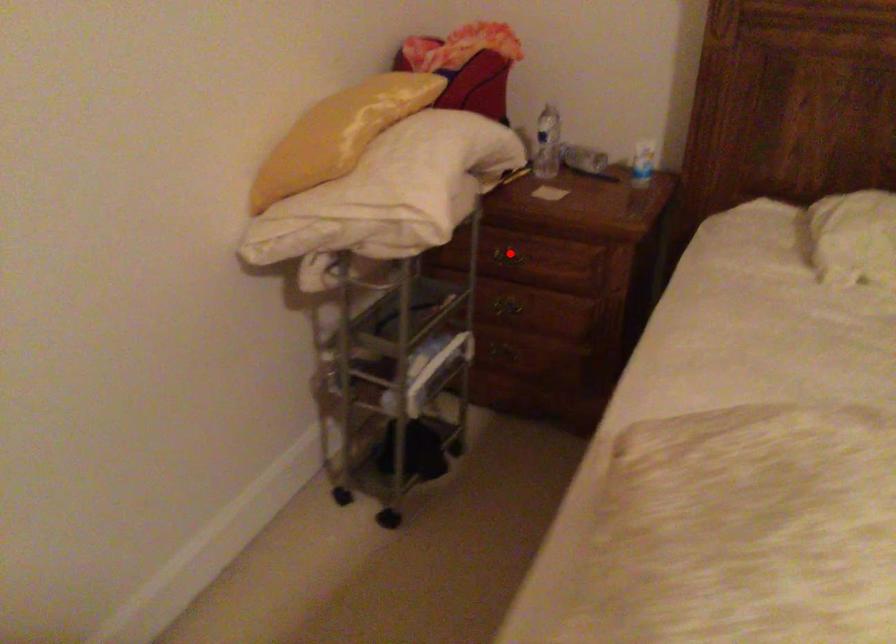
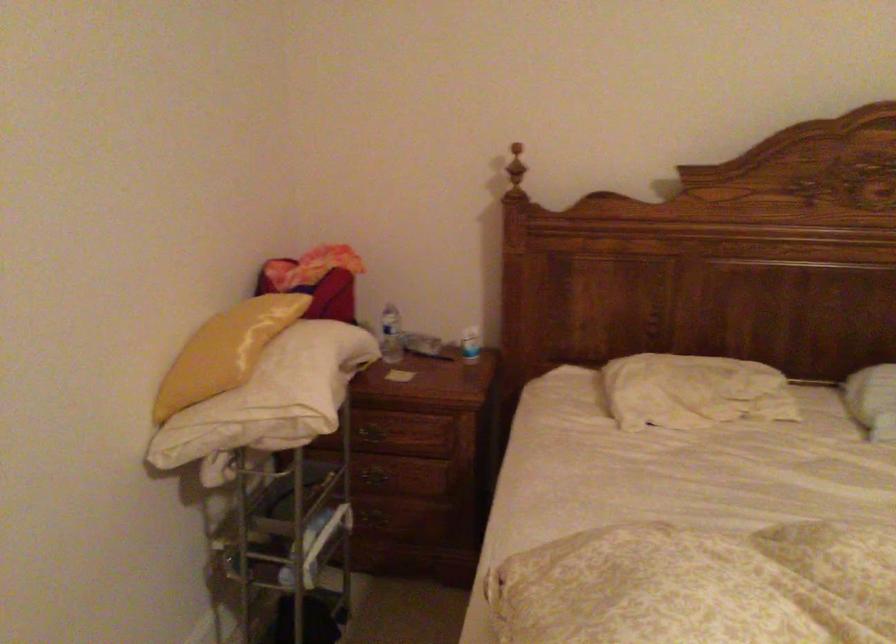
Question: I am providing you with two images of the same scene from different viewpoints. Image1 has a red point marked. In image2, the corresponding 3D location appears at what relative position? Reply with the corresponding letter.

Choices:
 (A) Closer
 (B) Farther

Answer: (B)